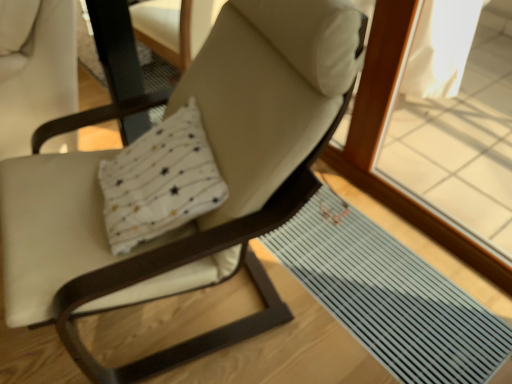
Question: From a real-world perspective, is gray rubber mat at lower right located beneath matte white swivel chair at left?

Choices:
 (A) yes
 (B) no

Answer: (A)

Question: Considering the relative sizes of gray rubber mat at lower right and matte white swivel chair at left in the image provided, is gray rubber mat at lower right bigger than matte white swivel chair at left?

Choices:
 (A) no
 (B) yes

Answer: (A)

Question: Is gray rubber mat at lower right outside matte white swivel chair at left?

Choices:
 (A) no
 (B) yes

Answer: (B)

Question: Is there a large distance between gray rubber mat at lower right and matte white swivel chair at left?

Choices:
 (A) yes
 (B) no

Answer: (A)

Question: Can you confirm if gray rubber mat at lower right is positioned to the right of matte white swivel chair at left?

Choices:
 (A) no
 (B) yes

Answer: (B)

Question: Considering the relative sizes of gray rubber mat at lower right and matte white swivel chair at left in the image provided, is gray rubber mat at lower right smaller than matte white swivel chair at left?

Choices:
 (A) no
 (B) yes

Answer: (B)

Question: From a real-world perspective, is matte white swivel chair at left positioned under gray rubber mat at lower right based on gravity?

Choices:
 (A) no
 (B) yes

Answer: (A)

Question: Considering the relative sizes of matte white swivel chair at left and gray rubber mat at lower right in the image provided, is matte white swivel chair at left bigger than gray rubber mat at lower right?

Choices:
 (A) yes
 (B) no

Answer: (A)

Question: Does matte white swivel chair at left have a smaller size compared to gray rubber mat at lower right?

Choices:
 (A) no
 (B) yes

Answer: (A)

Question: Does matte white swivel chair at left have a greater height compared to gray rubber mat at lower right?

Choices:
 (A) yes
 (B) no

Answer: (A)

Question: Is matte white swivel chair at left closer to the viewer compared to gray rubber mat at lower right?

Choices:
 (A) yes
 (B) no

Answer: (A)

Question: Is matte white swivel chair at left shorter than gray rubber mat at lower right?

Choices:
 (A) yes
 (B) no

Answer: (B)

Question: From the image's perspective, is gray rubber mat at lower right under matte white chair at center?

Choices:
 (A) no
 (B) yes

Answer: (B)